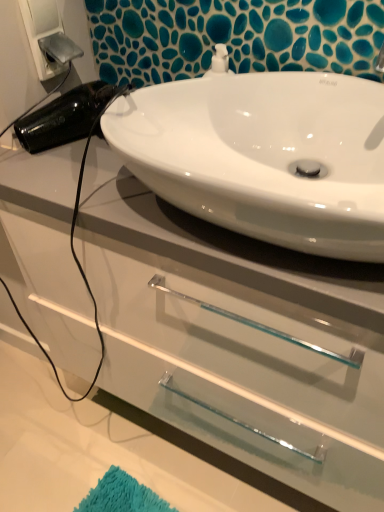
Question: Should I look upward or downward to see white plastic electric outlet at upper left?

Choices:
 (A) up
 (B) down

Answer: (A)

Question: From a real-world perspective, is white glossy sink at upper center positioned over white plastic electric outlet at upper left based on gravity?

Choices:
 (A) no
 (B) yes

Answer: (A)

Question: Considering the relative positions of white glossy sink at upper center and white plastic electric outlet at upper left in the image provided, is white glossy sink at upper center in front of white plastic electric outlet at upper left?

Choices:
 (A) yes
 (B) no

Answer: (A)

Question: Does white glossy sink at upper center have a greater height compared to white plastic electric outlet at upper left?

Choices:
 (A) no
 (B) yes

Answer: (A)

Question: Would you say white plastic electric outlet at upper left is part of white glossy sink at upper center's contents?

Choices:
 (A) yes
 (B) no

Answer: (B)

Question: From the image's perspective, is white glossy sink at upper center on top of white plastic electric outlet at upper left?

Choices:
 (A) no
 (B) yes

Answer: (A)

Question: Is white glossy sink at upper center at the left side of white plastic electric outlet at upper left?

Choices:
 (A) no
 (B) yes

Answer: (A)

Question: Is white plastic electric outlet at upper left not close to white glossy cabinet at center?

Choices:
 (A) yes
 (B) no

Answer: (B)

Question: Is white plastic electric outlet at upper left at the right side of white glossy cabinet at center?

Choices:
 (A) yes
 (B) no

Answer: (B)

Question: Is white plastic electric outlet at upper left directly adjacent to white glossy cabinet at center?

Choices:
 (A) yes
 (B) no

Answer: (B)

Question: From a real-world perspective, is white plastic electric outlet at upper left under white glossy cabinet at center?

Choices:
 (A) yes
 (B) no

Answer: (B)

Question: Is white plastic electric outlet at upper left thinner than white glossy cabinet at center?

Choices:
 (A) no
 (B) yes

Answer: (B)

Question: Is white plastic electric outlet at upper left shorter than white glossy cabinet at center?

Choices:
 (A) yes
 (B) no

Answer: (A)

Question: Can you see white glossy cabinet at center touching white plastic electric outlet at upper left?

Choices:
 (A) no
 (B) yes

Answer: (A)